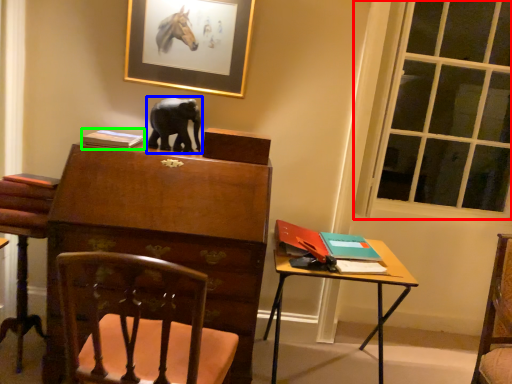
Question: Which is nearer to the window (highlighted by a red box)? elephant (highlighted by a blue box) or book (highlighted by a green box).

Choices:
 (A) elephant
 (B) book

Answer: (A)